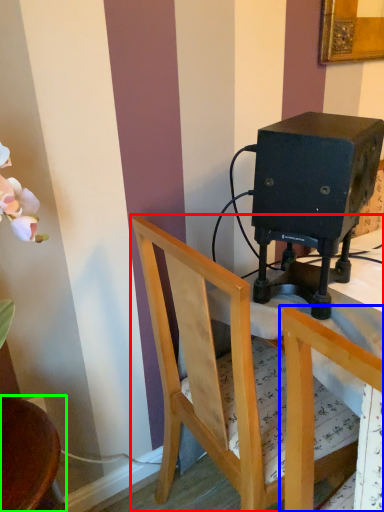
Question: Which is farther away from chair (highlighted by a red box)? chair (highlighted by a blue box) or chair (highlighted by a green box)?

Choices:
 (A) chair
 (B) chair

Answer: (B)